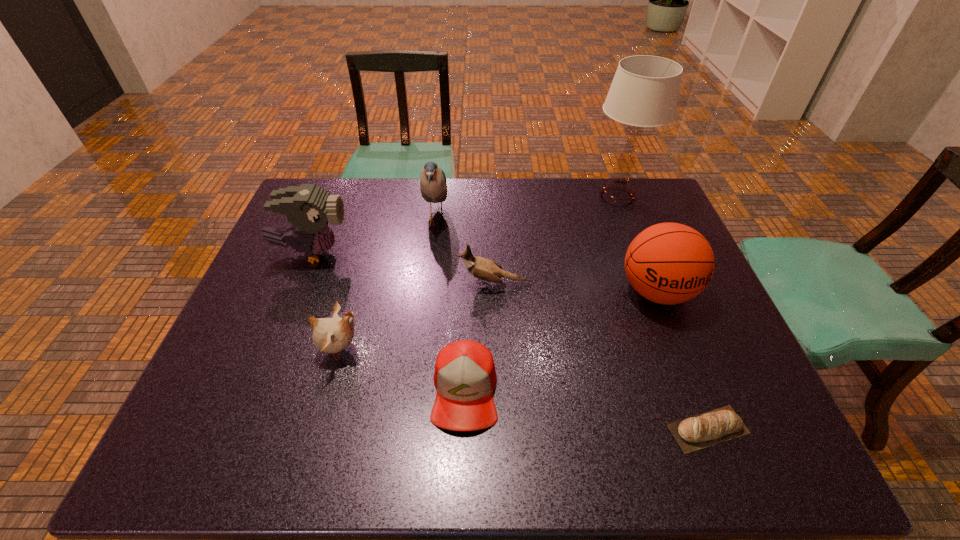
Locate an element on the screen. This screenshot has width=960, height=540. the tallest object is located at coordinates (644, 92).

Where is `the farthest bird`? the farthest bird is located at coordinates (433, 186).

I want to click on the third farthest object, so coord(309,208).

I want to click on basketball, so click(668, 263).

Locate an element on the screen. the rightmost bird is located at coordinates (485, 269).

This screenshot has width=960, height=540. Identify the location of the nearest bird. (331, 335).

Locate an element on the screen. baseball cap is located at coordinates (465, 377).

This screenshot has width=960, height=540. What are the coordinates of `the shortest object` in the screenshot? It's located at (710, 428).

Locate an element on the screen. This screenshot has width=960, height=540. blank space located 0.350m on the front-facing side of the table lamp is located at coordinates pos(481,198).

Identify the location of vacant space positioned 0.400m on the front-facing side of the table lamp. The height and width of the screenshot is (540, 960). (467, 198).